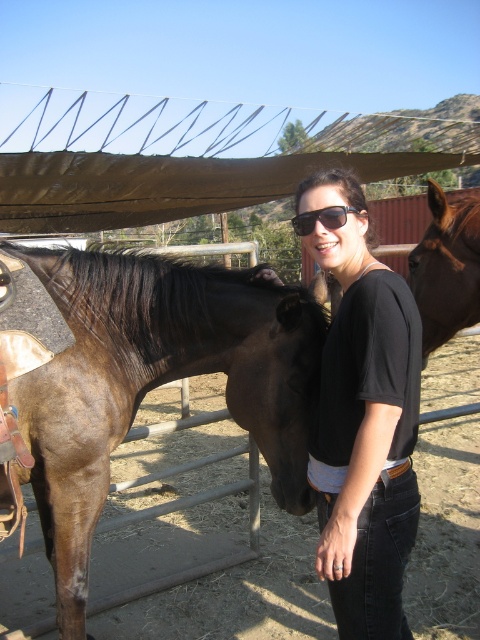
Does black cotton shirt at center appear under brown glossy horse at right?

Yes, black cotton shirt at center is below brown glossy horse at right.

Does black cotton shirt at center have a lesser width compared to brown glossy horse at right?

Indeed, black cotton shirt at center has a lesser width compared to brown glossy horse at right.

What do you see at coordinates (365, 435) in the screenshot?
I see `black cotton shirt at center` at bounding box center [365, 435].

This screenshot has height=640, width=480. What are the coordinates of `black cotton shirt at center` in the screenshot? It's located at (365, 435).

Which is more to the right, brown glossy horse at left or brown glossy horse at right?

Positioned to the right is brown glossy horse at right.

Who is positioned more to the left, brown glossy horse at left or brown glossy horse at right?

brown glossy horse at left is more to the left.

Does point (237, 342) come behind point (445, 211)?

Yes, point (237, 342) is farther from viewer.

Image resolution: width=480 pixels, height=640 pixels. Identify the location of brown glossy horse at left. (156, 381).

Does brown glossy horse at left appear on the right side of black cotton shirt at center?

No, brown glossy horse at left is not to the right of black cotton shirt at center.

Who is higher up, brown glossy horse at left or black cotton shirt at center?

black cotton shirt at center is above.

Where is `brown glossy horse at left`? The height and width of the screenshot is (640, 480). brown glossy horse at left is located at coordinates (156, 381).

The height and width of the screenshot is (640, 480). I want to click on brown glossy horse at left, so click(x=156, y=381).